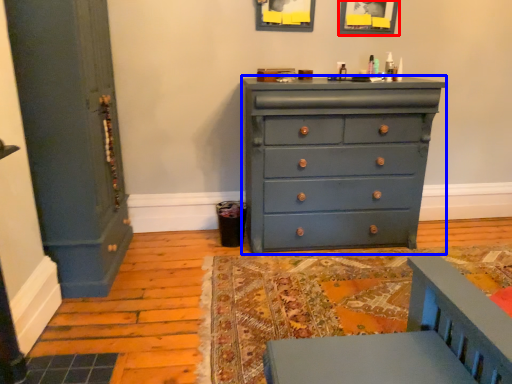
Question: Which point is closer to the camera, picture frame (highlighted by a red box) or chest of drawers (highlighted by a blue box)?

Choices:
 (A) picture frame
 (B) chest of drawers

Answer: (B)